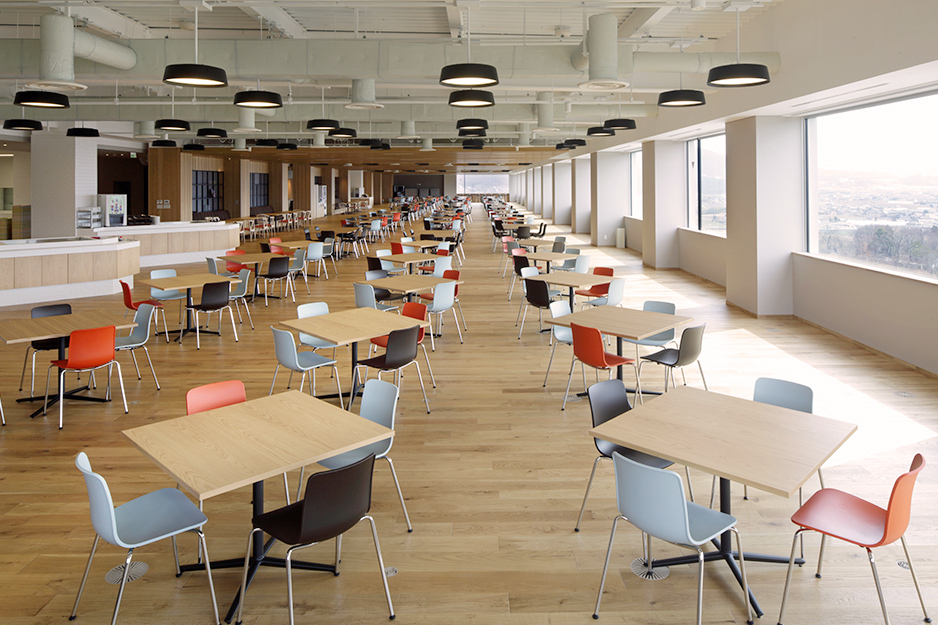
Find the location of a particular element. The height and width of the screenshot is (625, 938). windows is located at coordinates [487, 177], [633, 185], [700, 191], [828, 209].